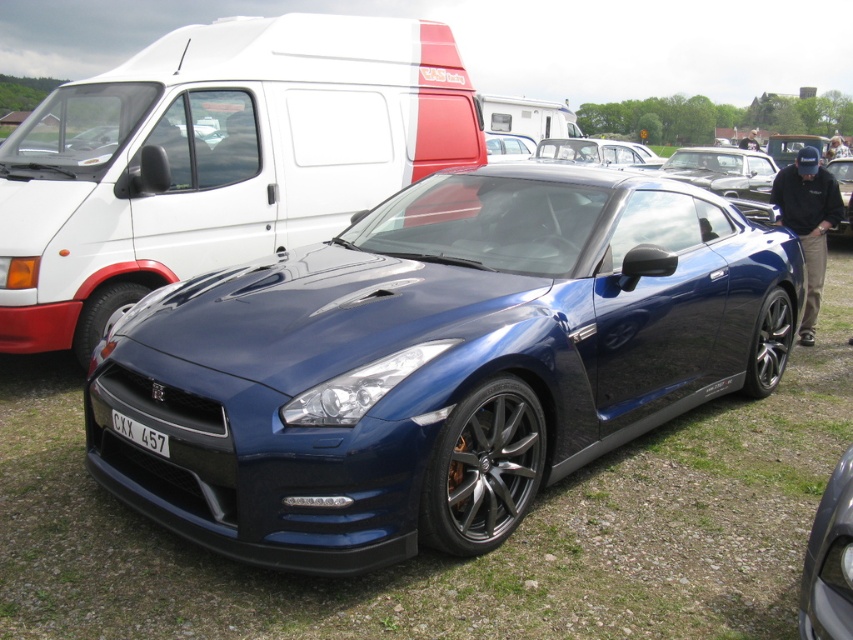
You are attending a car exhibition and notice two items in the scene. One is the white matte van at upper center and the other is the white plastic license plate at center. Which of these two items is taller?

The white matte van at upper center is taller than the white plastic license plate at center.